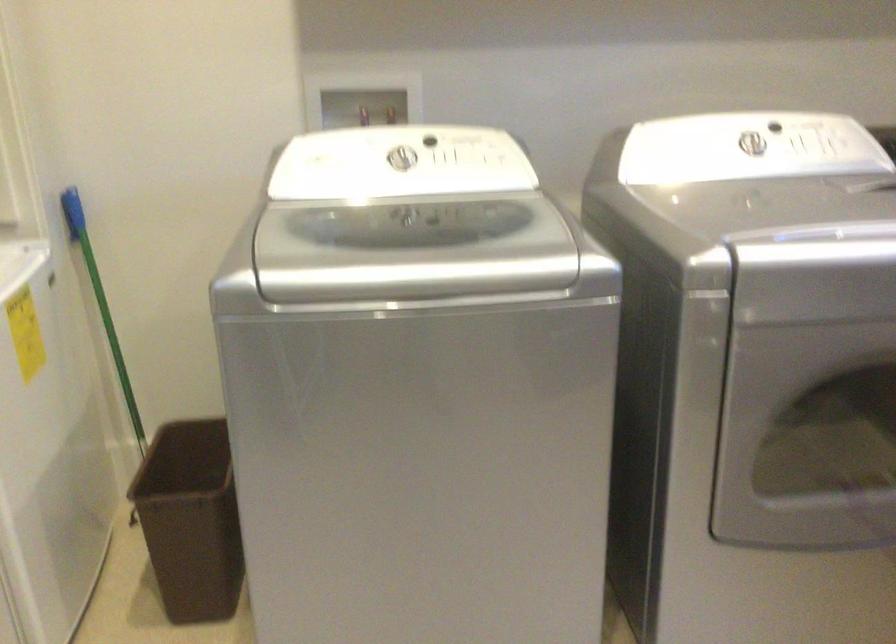
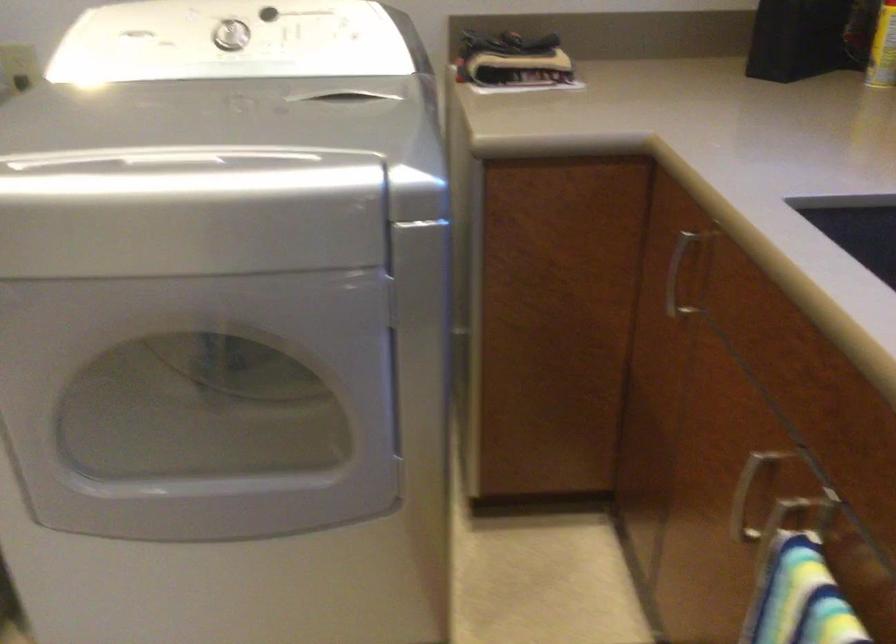
The point at (745, 147) is marked in the first image. Where is the corresponding point in the second image?

(229, 35)